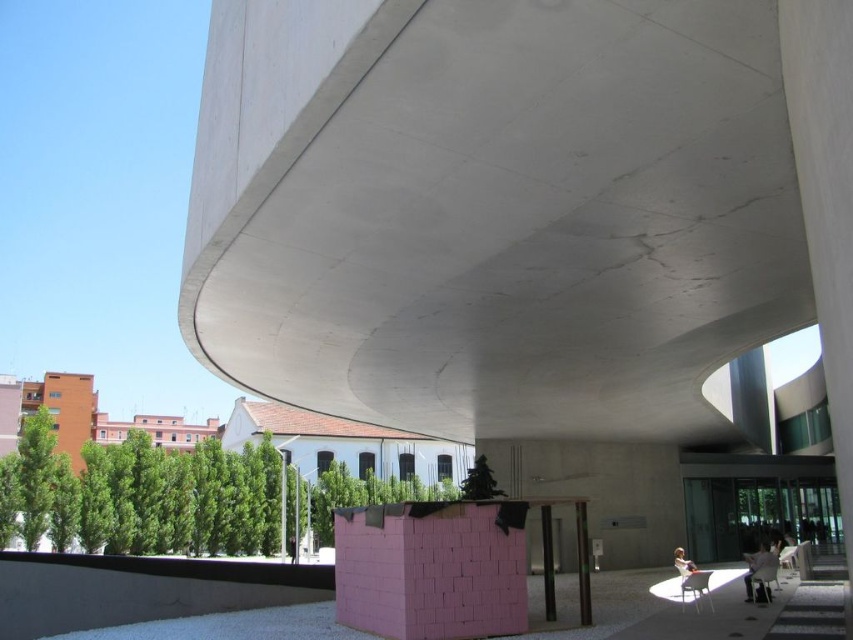
Is green leafy tree at lower left positioned in front of pink foam block at center?

No, green leafy tree at lower left is behind pink foam block at center.

You are a GUI agent. You are given a task and a screenshot of the screen. Output one action in this format:
    pyautogui.click(x=<x>, y=<y>)
    Task: Click on the green leafy tree at lower left
    This screenshot has height=640, width=853.
    Given the screenshot: What is the action you would take?
    pyautogui.click(x=189, y=497)

Who is shorter, smooth gray pillar at center or green matte tree at center?

Standing shorter between the two is smooth gray pillar at center.

Who is higher up, smooth gray pillar at center or green matte tree at center?

Positioned higher is smooth gray pillar at center.

Where is `smooth gray pillar at center`? This screenshot has height=640, width=853. smooth gray pillar at center is located at coordinates (547, 563).

Is the position of green leafy tree at lower left more distant than that of smooth concrete pillar at center?

Yes, green leafy tree at lower left is behind smooth concrete pillar at center.

Does green leafy tree at lower left appear on the left side of smooth concrete pillar at center?

Correct, you'll find green leafy tree at lower left to the left of smooth concrete pillar at center.

Who is more distant from viewer, (0, 524) or (579, 621)?

Positioned behind is point (0, 524).

Identify the location of green leafy tree at lower left. The width and height of the screenshot is (853, 640). (189, 497).